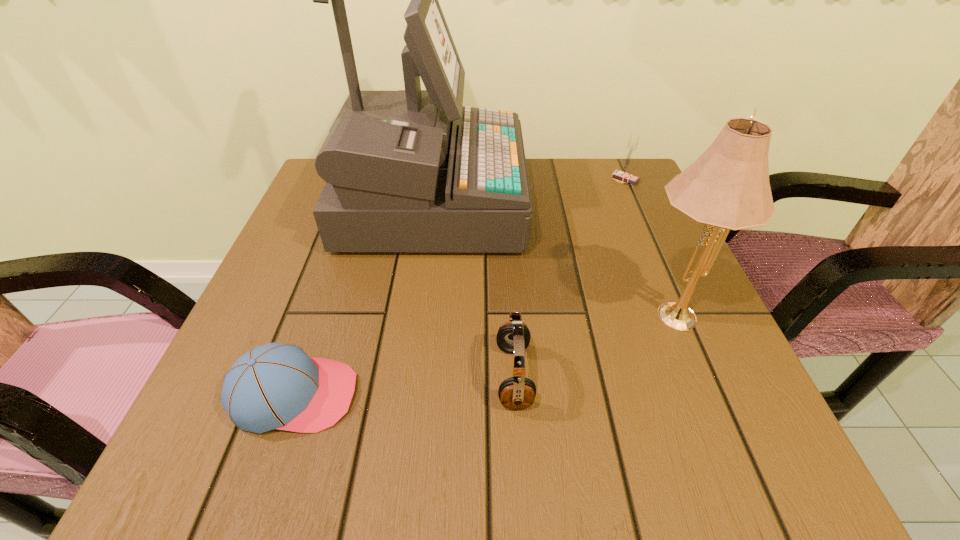
Image resolution: width=960 pixels, height=540 pixels. I want to click on free area in between the cash register and the lampshade, so click(549, 256).

Where is `free area in between the shortest object and the headset`? This screenshot has height=540, width=960. free area in between the shortest object and the headset is located at coordinates (404, 386).

Find the location of `free space between the matchbox and the headset`. free space between the matchbox and the headset is located at coordinates (569, 278).

Identify the location of free space between the shortest object and the lampshade. (482, 353).

Where is `vacant area that lies between the headset and the baseball cap`? vacant area that lies between the headset and the baseball cap is located at coordinates (404, 386).

At what (x,y) coordinates should I click in order to perform the action: click on free space between the fourth shortest object and the matchbox. Please return your answer as a coordinate pair (x, y). Looking at the image, I should click on pyautogui.click(x=647, y=245).

Locate which object ranks second in proximity to the matchbox. Please provide its 2D coordinates. Your answer should be formatted as a tuple, i.e. [(x, y)], where the tuple contains the x and y coordinates of a point satisfying the conditions above.

[(728, 187)]

Select which object is the second closest to the baseball cap. Please provide its 2D coordinates. Your answer should be formatted as a tuple, i.e. [(x, y)], where the tuple contains the x and y coordinates of a point satisfying the conditions above.

[(412, 170)]

I want to click on vacant space that satisfies the following two spatial constraints: 1. on the front side of the matchbox; 2. on the front-facing side of the shortest object, so click(720, 395).

You are a GUI agent. You are given a task and a screenshot of the screen. Output one action in this format:
    pyautogui.click(x=<x>, y=<y>)
    Task: Click on the vacant position in the image that satisfies the following two spatial constraints: 1. on the front side of the lampshade; 2. on the ear cups of the headset
    
    Given the screenshot: What is the action you would take?
    pyautogui.click(x=696, y=376)